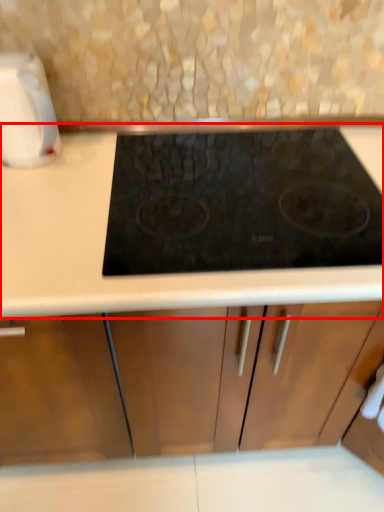
Question: Observing the image, what is the correct spatial positioning of countertop (annotated by the red box) in reference to kitchen appliance?

Choices:
 (A) right
 (B) left

Answer: (A)